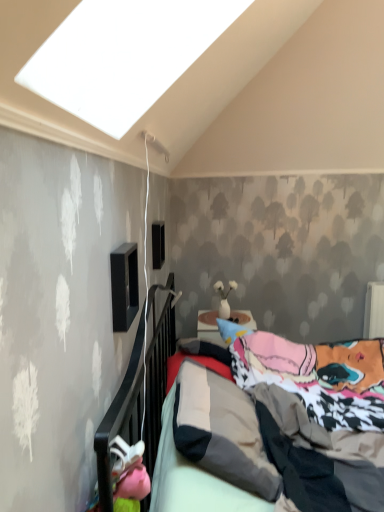
Question: Does black matte window at upper center, which appears as the 1th window when viewed from the back, appear on the left side of black matte speaker at upper left, which ranks as the second window in back-to-front order?

Choices:
 (A) yes
 (B) no

Answer: (B)

Question: Is black matte window at upper center, which is the 2th window in front-to-back order, not close to black matte speaker at upper left, arranged as the 1th window when viewed from the front?

Choices:
 (A) yes
 (B) no

Answer: (A)

Question: Is black matte window at upper center, which appears as the 1th window when viewed from the back, positioned with its back to black matte speaker at upper left, arranged as the 1th window when viewed from the front?

Choices:
 (A) yes
 (B) no

Answer: (B)

Question: Could you tell me if black matte window at upper center, which is the 2th window in front-to-back order, is facing black matte speaker at upper left, which ranks as the second window in back-to-front order?

Choices:
 (A) yes
 (B) no

Answer: (B)

Question: Considering the relative sizes of black matte window at upper center, which is the 2th window in front-to-back order, and black matte speaker at upper left, which ranks as the second window in back-to-front order, in the image provided, is black matte window at upper center, which is the 2th window in front-to-back order, thinner than black matte speaker at upper left, which ranks as the second window in back-to-front order,?

Choices:
 (A) yes
 (B) no

Answer: (A)

Question: Can you confirm if black matte window at upper center, which is the 2th window in front-to-back order, is bigger than black matte speaker at upper left, which ranks as the second window in back-to-front order?

Choices:
 (A) no
 (B) yes

Answer: (A)

Question: Considering the relative sizes of black matte speaker at upper left, arranged as the 1th window when viewed from the front, and mattress at center in the image provided, is black matte speaker at upper left, arranged as the 1th window when viewed from the front, shorter than mattress at center?

Choices:
 (A) no
 (B) yes

Answer: (B)

Question: Is black matte speaker at upper left, arranged as the 1th window when viewed from the front, to the right of mattress at center from the viewer's perspective?

Choices:
 (A) yes
 (B) no

Answer: (B)

Question: From a real-world perspective, is black matte speaker at upper left, arranged as the 1th window when viewed from the front, below mattress at center?

Choices:
 (A) yes
 (B) no

Answer: (B)

Question: From a real-world perspective, is black matte speaker at upper left, which ranks as the second window in back-to-front order, on mattress at center?

Choices:
 (A) no
 (B) yes

Answer: (B)

Question: Does black matte speaker at upper left, which ranks as the second window in back-to-front order, have a larger size compared to mattress at center?

Choices:
 (A) no
 (B) yes

Answer: (A)

Question: Does black matte speaker at upper left, arranged as the 1th window when viewed from the front, have a smaller size compared to mattress at center?

Choices:
 (A) yes
 (B) no

Answer: (A)

Question: Is black matte window at upper center, which appears as the 1th window when viewed from the back, at the back of black matte speaker at upper left, which ranks as the second window in back-to-front order?

Choices:
 (A) no
 (B) yes

Answer: (A)